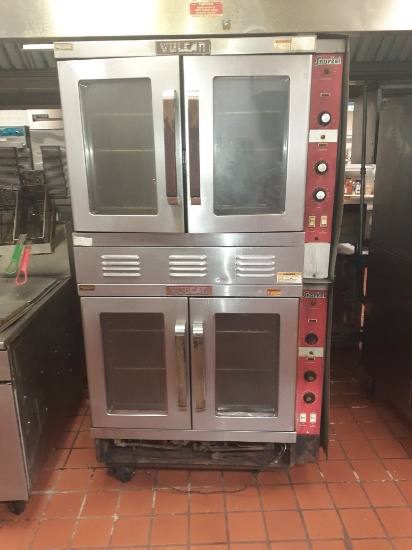
Identify the location of floor below oven. (199, 474).